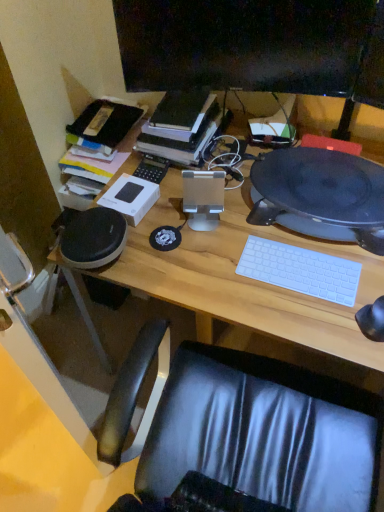
Question: Should I look upward or downward to see hardcover book at center?

Choices:
 (A) down
 (B) up

Answer: (B)

Question: Can you confirm if hardcover book at center is positioned to the left of black matte speaker at right?

Choices:
 (A) no
 (B) yes

Answer: (B)

Question: Can you confirm if hardcover book at center is smaller than black matte speaker at right?

Choices:
 (A) no
 (B) yes

Answer: (B)

Question: Considering the relative positions of hardcover book at center and black matte speaker at right in the image provided, is hardcover book at center to the right of black matte speaker at right from the viewer's perspective?

Choices:
 (A) yes
 (B) no

Answer: (B)

Question: Considering the relative sizes of hardcover book at center and black matte speaker at right in the image provided, is hardcover book at center bigger than black matte speaker at right?

Choices:
 (A) no
 (B) yes

Answer: (A)

Question: Can you see hardcover book at center touching black matte speaker at right?

Choices:
 (A) no
 (B) yes

Answer: (A)

Question: From the image's perspective, would you say hardcover book at center is positioned over black matte speaker at right?

Choices:
 (A) yes
 (B) no

Answer: (A)

Question: Is white matte keyboard at center facing towards wooden desk at center?

Choices:
 (A) yes
 (B) no

Answer: (B)

Question: From a real-world perspective, does white matte keyboard at center sit lower than wooden desk at center?

Choices:
 (A) yes
 (B) no

Answer: (B)

Question: Are white matte keyboard at center and wooden desk at center far apart?

Choices:
 (A) yes
 (B) no

Answer: (B)

Question: Is white matte keyboard at center positioned behind wooden desk at center?

Choices:
 (A) yes
 (B) no

Answer: (A)

Question: From the image's perspective, is white matte keyboard at center below wooden desk at center?

Choices:
 (A) no
 (B) yes

Answer: (A)

Question: Does white matte keyboard at center have a lesser width compared to wooden desk at center?

Choices:
 (A) no
 (B) yes

Answer: (B)

Question: Is black glossy monitor at upper center to the right of wooden desk at center from the viewer's perspective?

Choices:
 (A) yes
 (B) no

Answer: (B)